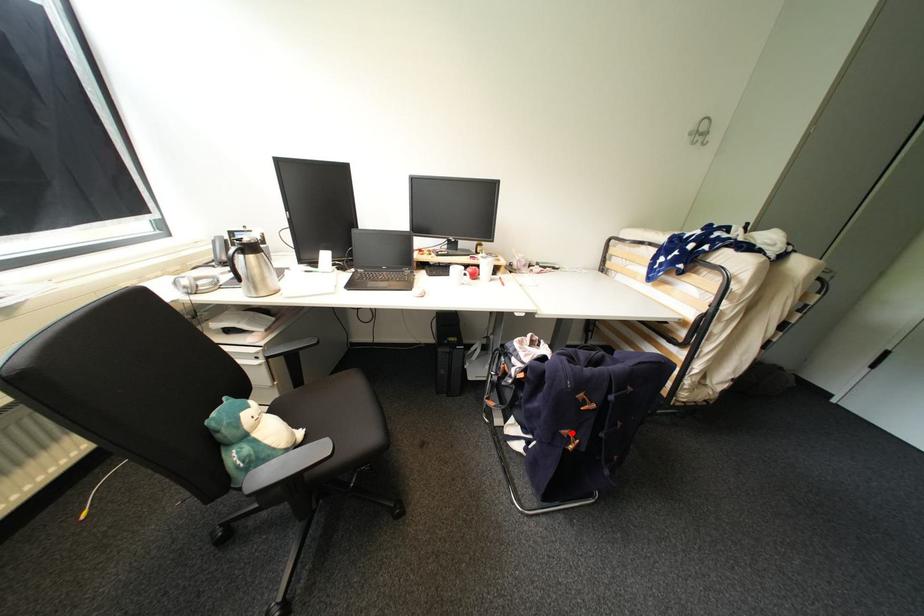
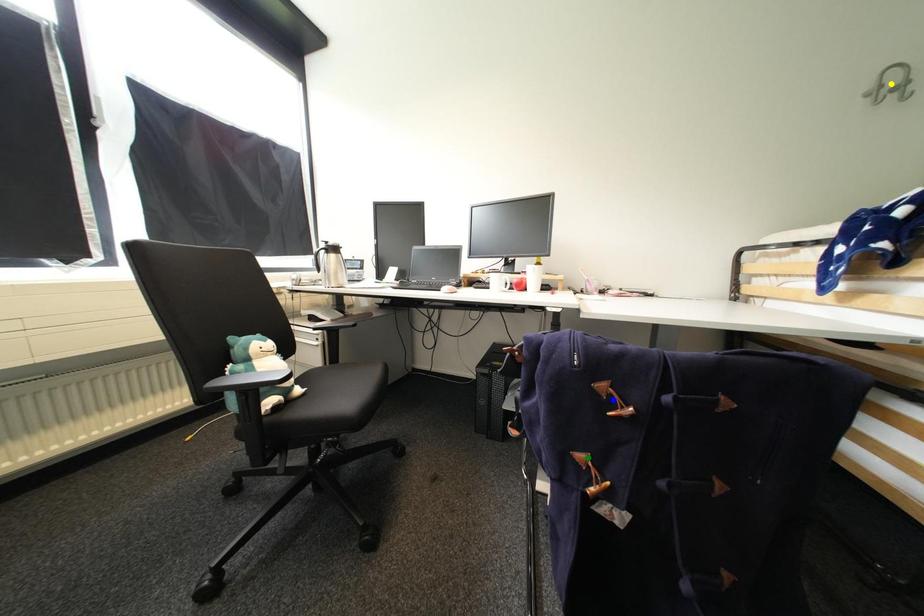
Question: I am providing you with two images of the same scene from different viewpoints. A red point is marked on the first image. You are given multiple points on the second image. Which spot in image 2 lines up with the point in image 1?

Choices:
 (A) blue point
 (B) yellow point
 (C) green point

Answer: (C)